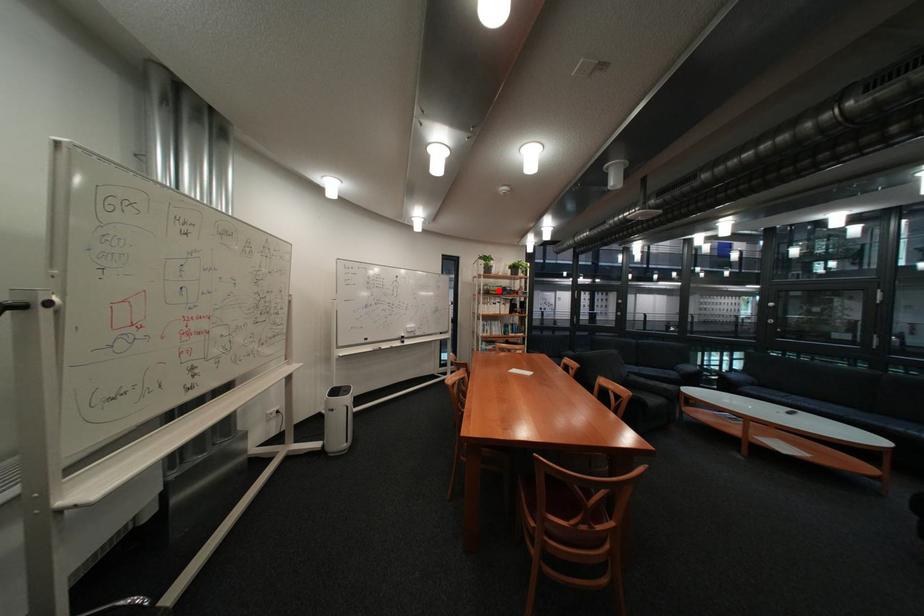
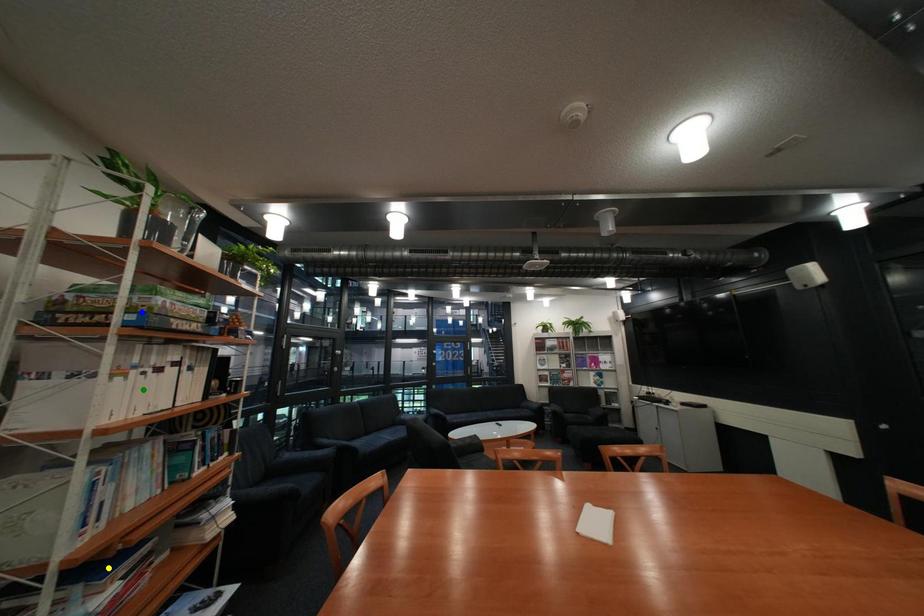
Question: I am providing you with two images of the same scene from different viewpoints. A red point is marked on the first image. You are given multiple points on the second image. Which spot in image 2 lines up with the point in image 1?

Choices:
 (A) blue point
 (B) yellow point
 (C) green point

Answer: (A)